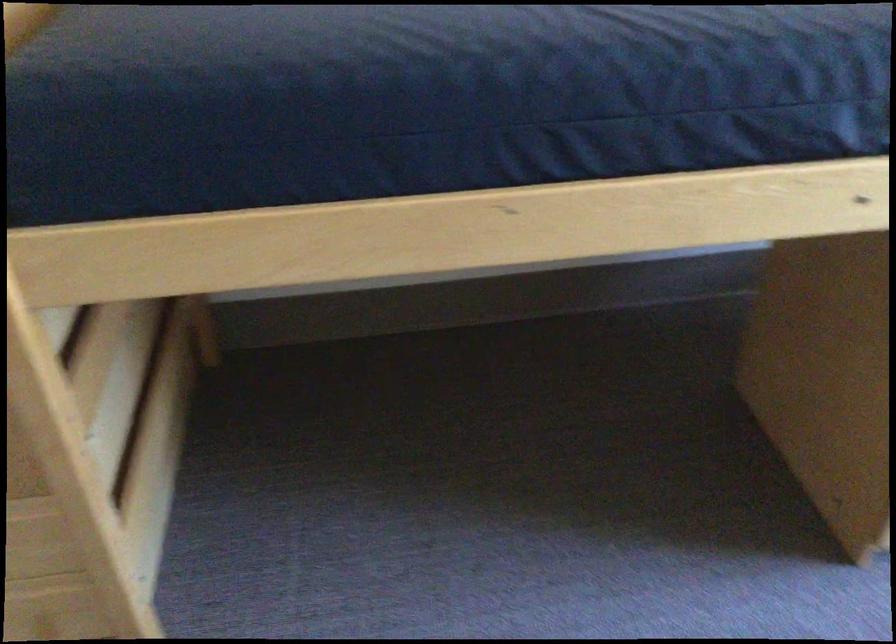
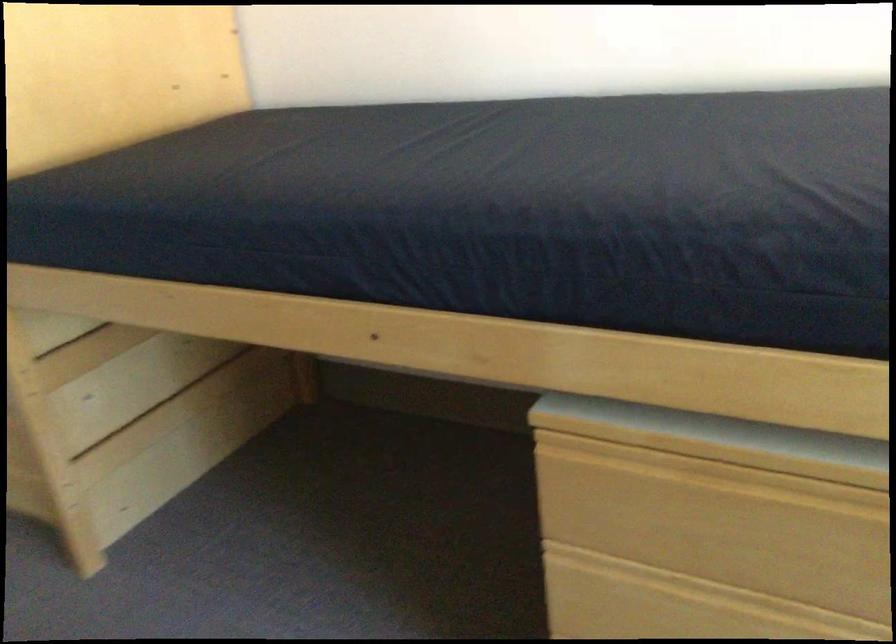
In the second image, find the point that corresponds to point 159,457 in the first image.

(195, 444)